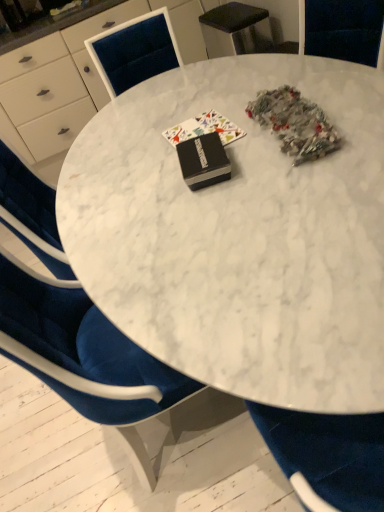
Locate an element on the screen. The height and width of the screenshot is (512, 384). vacant area situated to the left side of black matte book at center, which ranks as the second book in back-to-front order is located at coordinates (141, 193).